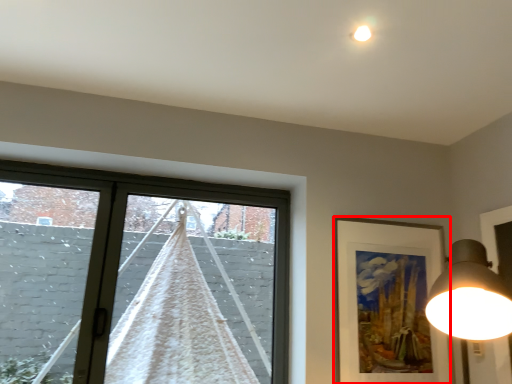
Question: From the image's perspective, what is the correct spatial positioning of picture frame (annotated by the red box) in reference to curtain?

Choices:
 (A) below
 (B) above

Answer: (A)